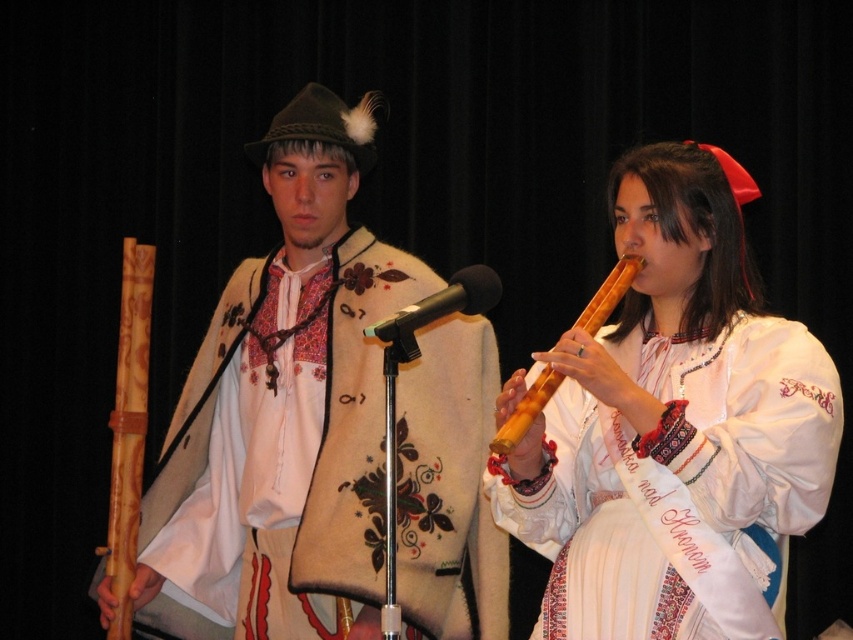
Between point (120, 536) and point (604, 320), which one is positioned behind?

The point (120, 536) is behind.

Looking at this image, is natural wood flute at left smaller than wooden flute at center?

Yes, natural wood flute at left is smaller than wooden flute at center.

Does point (143, 378) come farther from viewer compared to point (618, 268)?

Yes, it is.

This screenshot has height=640, width=853. In order to click on natural wood flute at left in this screenshot , I will do `click(128, 428)`.

Who is shorter, white embroidered blouse at right or wooden flute at center?

With less height is wooden flute at center.

Is white embroidered blouse at right below wooden flute at center?

Yes.

Does point (608, 497) lie behind point (596, 305)?

No, (608, 497) is closer to viewer.

I want to click on white embroidered blouse at right, so click(679, 484).

Is white embroidered blouse at right further to the viewer compared to white woolen vest at center?

No, it is in front of white woolen vest at center.

Who is taller, white embroidered blouse at right or white woolen vest at center?

white woolen vest at center

In order to click on white embroidered blouse at right in this screenshot , I will do `click(679, 484)`.

What are the coordinates of `white embroidered blouse at right` in the screenshot? It's located at (679, 484).